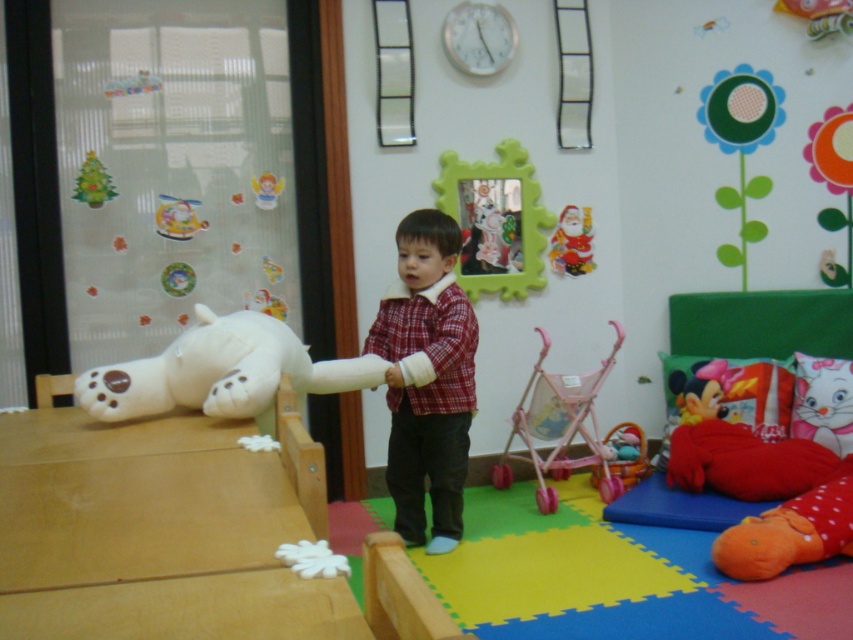
Question: Considering the real-world distances, which object is farthest from the shiny red santa claus at upper center?

Choices:
 (A) red plaid shirt at center
 (B) pink plastic stroller at lower right
 (C) matte pink stroller at lower center
 (D) green matte christmas tree at upper left

Answer: (D)

Question: Considering the relative positions of white plush bear at left and matte pink stroller at lower center in the image provided, where is white plush bear at left located with respect to matte pink stroller at lower center?

Choices:
 (A) above
 (B) below

Answer: (A)

Question: Does white plush bear at left appear on the left side of shiny red santa claus at upper center?

Choices:
 (A) no
 (B) yes

Answer: (B)

Question: Can you confirm if pink plastic stroller at lower right is smaller than green matte christmas tree at upper left?

Choices:
 (A) no
 (B) yes

Answer: (A)

Question: Which point appears farthest from the camera in this image?

Choices:
 (A) (630, 432)
 (B) (618, 332)
 (C) (341, 364)

Answer: (A)

Question: Which point is closer to the camera?

Choices:
 (A) shiny red santa claus at upper center
 (B) pink plastic stroller at lower right
 (C) red plaid shirt at center

Answer: (C)